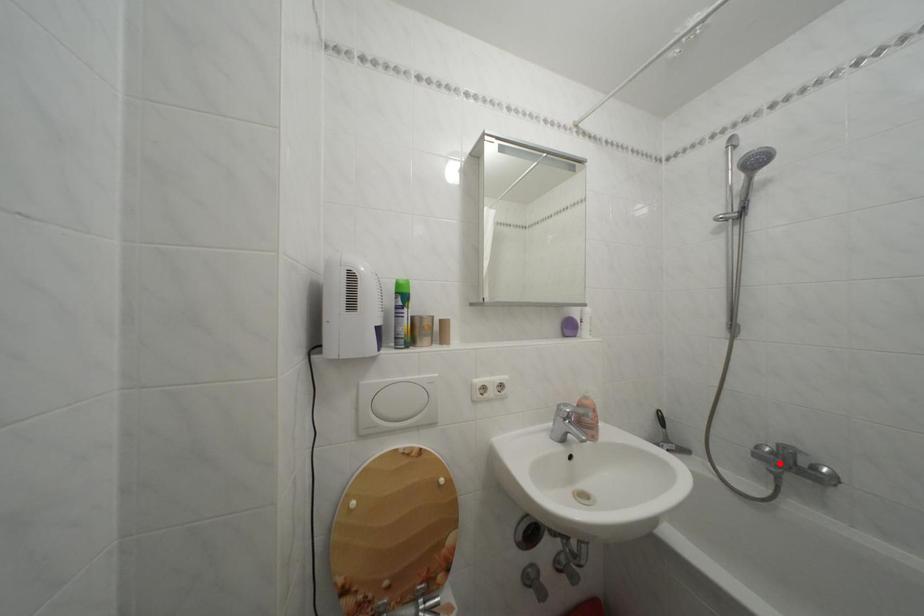
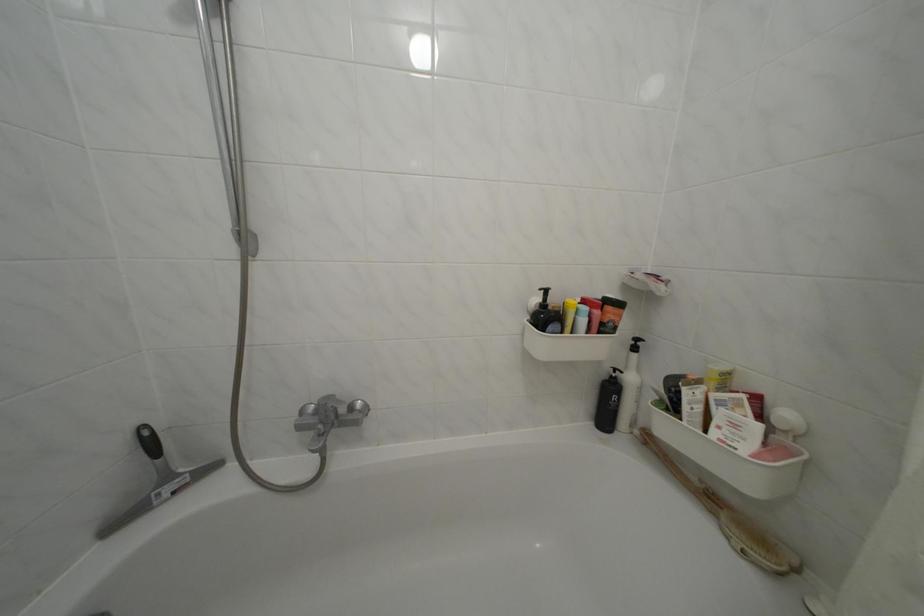
Question: I am providing you with two images of the same scene from different viewpoints. Image1 has a red point marked. In image2, the corresponding 3D location appears at what relative position? Reply with the corresponding letter.

Choices:
 (A) Closer
 (B) Farther

Answer: (B)